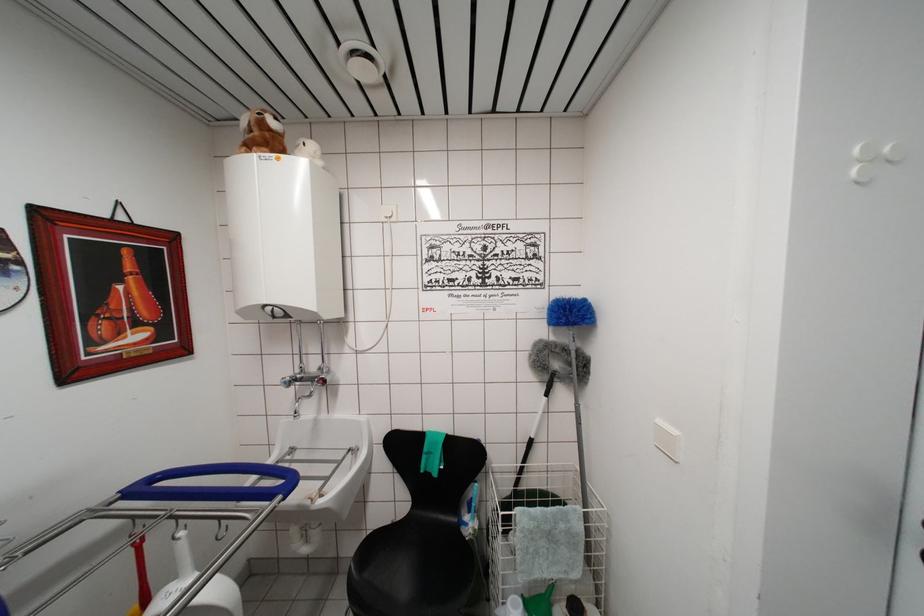
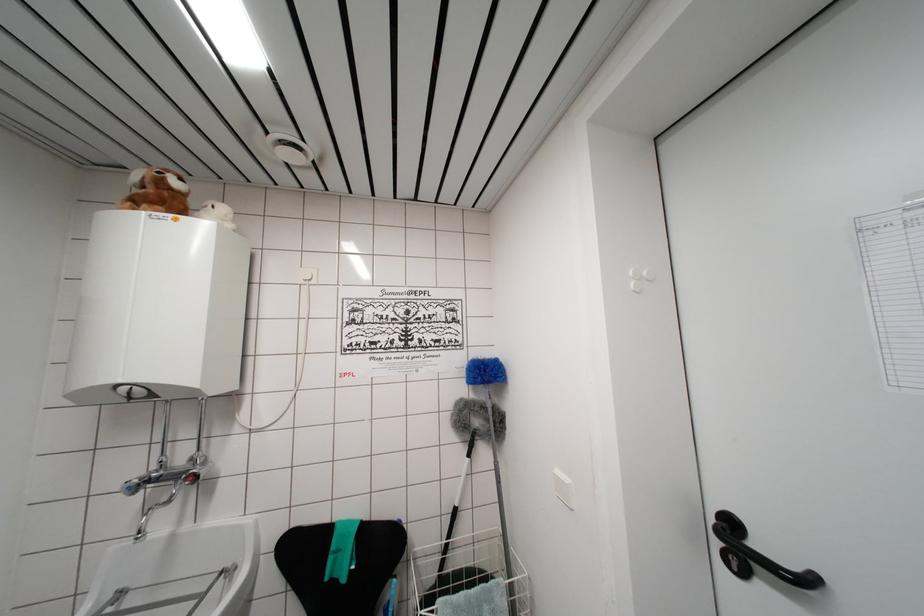
Find the pixel in the second image that matches pixel 395 221 in the first image.

(314, 284)